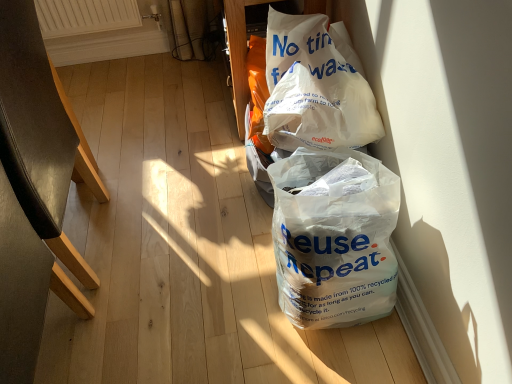
Find the location of a particular element. The image size is (512, 384). empty space that is in between black leather chair at left and white plastic bag at lower right, the second plastic bag in the top-to-bottom sequence is located at coordinates (197, 267).